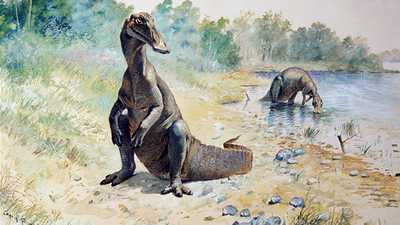
Where is `painting`? This screenshot has height=225, width=400. painting is located at coordinates (196, 125).